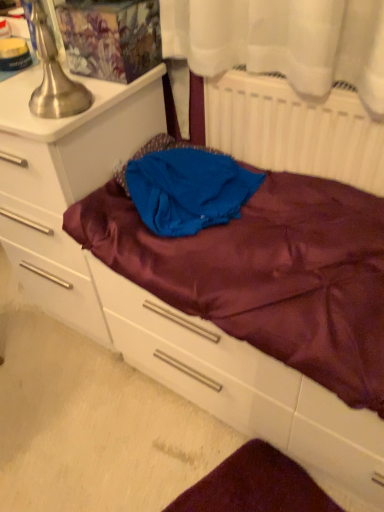
Question: Considering the relative sizes of blue satin cloth at center and satin purple drawer at center in the image provided, is blue satin cloth at center smaller than satin purple drawer at center?

Choices:
 (A) no
 (B) yes

Answer: (B)

Question: Is the position of blue satin cloth at center less distant than that of satin purple drawer at center?

Choices:
 (A) no
 (B) yes

Answer: (A)

Question: Considering the relative sizes of blue satin cloth at center and satin purple drawer at center in the image provided, is blue satin cloth at center taller than satin purple drawer at center?

Choices:
 (A) no
 (B) yes

Answer: (A)

Question: From the image's perspective, would you say blue satin cloth at center is shown under satin purple drawer at center?

Choices:
 (A) no
 (B) yes

Answer: (A)

Question: Are blue satin cloth at center and satin purple drawer at center making contact?

Choices:
 (A) yes
 (B) no

Answer: (B)

Question: Considering their positions, is satin purple drawer at center located in front of or behind matte white chest of drawers at left?

Choices:
 (A) front
 (B) behind

Answer: (A)

Question: From the image's perspective, relative to matte white chest of drawers at left, is satin purple drawer at center above or below?

Choices:
 (A) above
 (B) below

Answer: (B)

Question: In terms of height, does satin purple drawer at center look taller or shorter compared to matte white chest of drawers at left?

Choices:
 (A) tall
 (B) short

Answer: (B)

Question: Visually, is satin purple drawer at center positioned to the left or to the right of matte white chest of drawers at left?

Choices:
 (A) left
 (B) right

Answer: (B)

Question: Is white matte radiator at upper right to the left or to the right of matte white chest of drawers at left in the image?

Choices:
 (A) right
 (B) left

Answer: (A)

Question: Is point (354, 178) closer or farther from the camera than point (26, 200)?

Choices:
 (A) farther
 (B) closer

Answer: (B)

Question: From a real-world perspective, is white matte radiator at upper right positioned above or below matte white chest of drawers at left?

Choices:
 (A) below
 (B) above

Answer: (B)

Question: In terms of width, does white matte radiator at upper right look wider or thinner when compared to matte white chest of drawers at left?

Choices:
 (A) thin
 (B) wide

Answer: (A)

Question: Relative to matte white chest of drawers at left, is brushed metal table lamp at upper left in front or behind?

Choices:
 (A) front
 (B) behind

Answer: (A)

Question: Considering the positions of point (39, 101) and point (56, 261), is point (39, 101) closer or farther from the camera than point (56, 261)?

Choices:
 (A) closer
 (B) farther

Answer: (A)